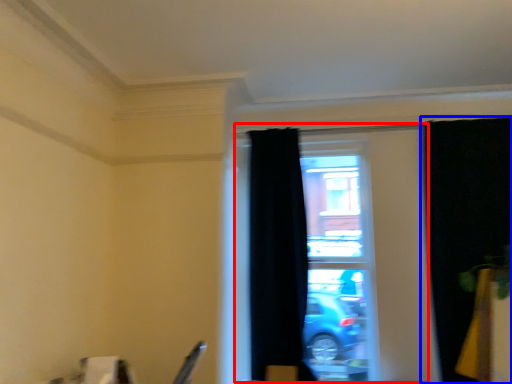
Question: Which object appears farthest to the camera in this image, window (highlighted by a red box) or curtain (highlighted by a blue box)?

Choices:
 (A) window
 (B) curtain

Answer: (A)